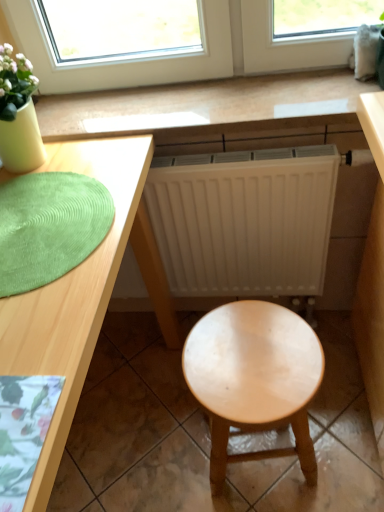
The width and height of the screenshot is (384, 512). Find the location of `vacant space underneath green textured mat at left (from a real-world perspective)`. vacant space underneath green textured mat at left (from a real-world perspective) is located at coordinates (46, 221).